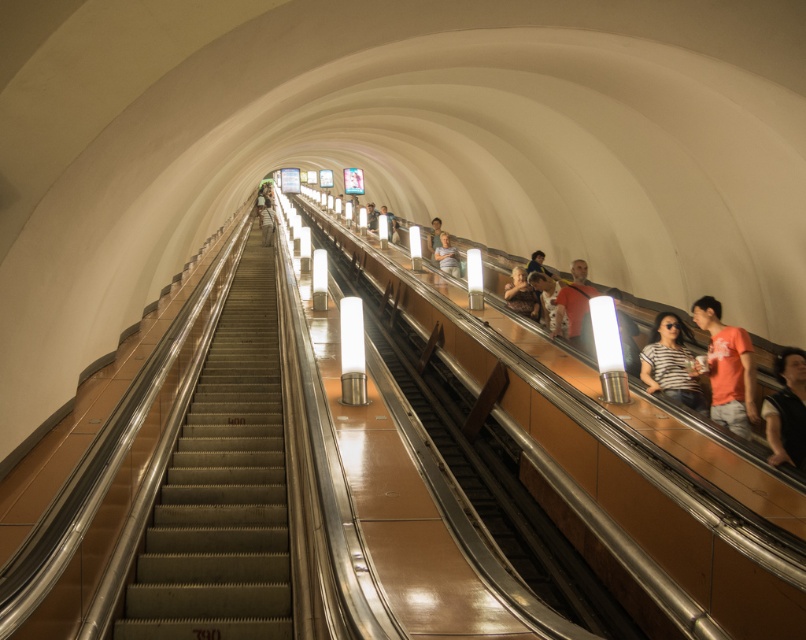
You are a fashion designer observing a subway scene. You notice a striped fabric shirt at right and a light brown leather jacket at upper center. Which clothing item is wider?

The striped fabric shirt at right is wider than the light brown leather jacket at upper center.

You are standing at the bottom of the escalator and see both the striped fabric shirt at right and the matte black jacket at upper center. Which one is closer to you?

The striped fabric shirt at right is closer to you because it is in front of the matte black jacket at upper center.